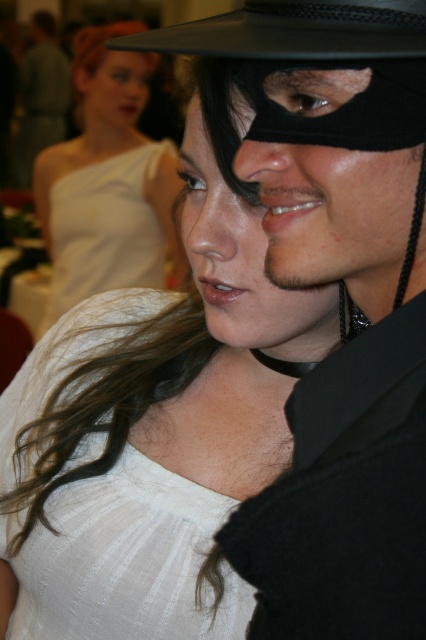
Question: Is matte white dress at center closer to camera compared to black matte fedora at upper center?

Choices:
 (A) yes
 (B) no

Answer: (B)

Question: Is matte white dress at center to the left of blonde hair at upper left from the viewer's perspective?

Choices:
 (A) yes
 (B) no

Answer: (B)

Question: Which is nearer to the matte white dress at center?

Choices:
 (A) matte black mask at center
 (B) blonde hair at upper left
 (C) black matte mask at upper right
 (D) black matte fedora at upper center

Answer: (B)

Question: Which object is positioned farthest from the blonde hair at upper left?

Choices:
 (A) matte black mask at center
 (B) black matte fedora at upper center
 (C) matte white dress at center
 (D) black matte mask at upper right

Answer: (D)

Question: Which point is closer to the camera?

Choices:
 (A) blonde hair at upper left
 (B) matte white dress at center

Answer: (B)

Question: Does matte black mask at center come behind blonde hair at upper left?

Choices:
 (A) no
 (B) yes

Answer: (A)